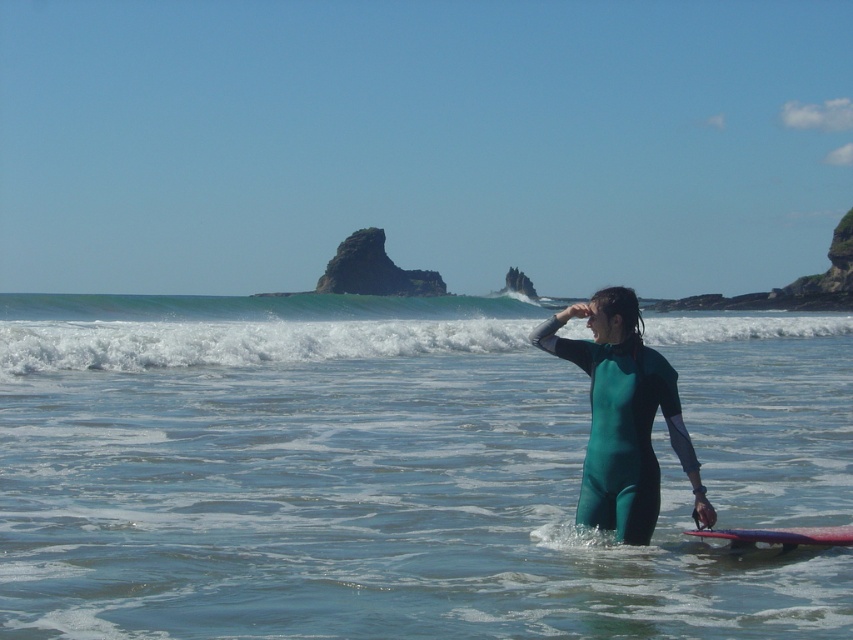
Is green rubber wetsuit at center positioned at the back of smooth purple surfboard at center?

That is False.

Who is more distant from viewer, (100, 582) or (776, 528)?

Point (776, 528)

Where is `green rubber wetsuit at center`? The width and height of the screenshot is (853, 640). green rubber wetsuit at center is located at coordinates (337, 481).

Measure the distance between green matte wetsuit at center and smooth purple surfboard at center.

green matte wetsuit at center and smooth purple surfboard at center are 1.27 meters apart.

Can you confirm if green matte wetsuit at center is positioned above smooth purple surfboard at center?

Result: Correct, green matte wetsuit at center is located above smooth purple surfboard at center.

Does point (654, 502) come behind point (830, 538)?

Yes, point (654, 502) is farther from viewer.

Locate an element on the screen. green matte wetsuit at center is located at coordinates (x=622, y=429).

Can you confirm if green rubber wetsuit at center is taller than white foamy wave at upper center?

No.

Is green rubber wetsuit at center to the left of white foamy wave at upper center from the viewer's perspective?

In fact, green rubber wetsuit at center is to the right of white foamy wave at upper center.

Is point (253, 586) less distant than point (326, 352)?

Yes, point (253, 586) is closer to viewer.

At what (x,y) coordinates should I click in order to perform the action: click on green rubber wetsuit at center. Please return your answer as a coordinate pair (x, y). Image resolution: width=853 pixels, height=640 pixels. Looking at the image, I should click on (337, 481).